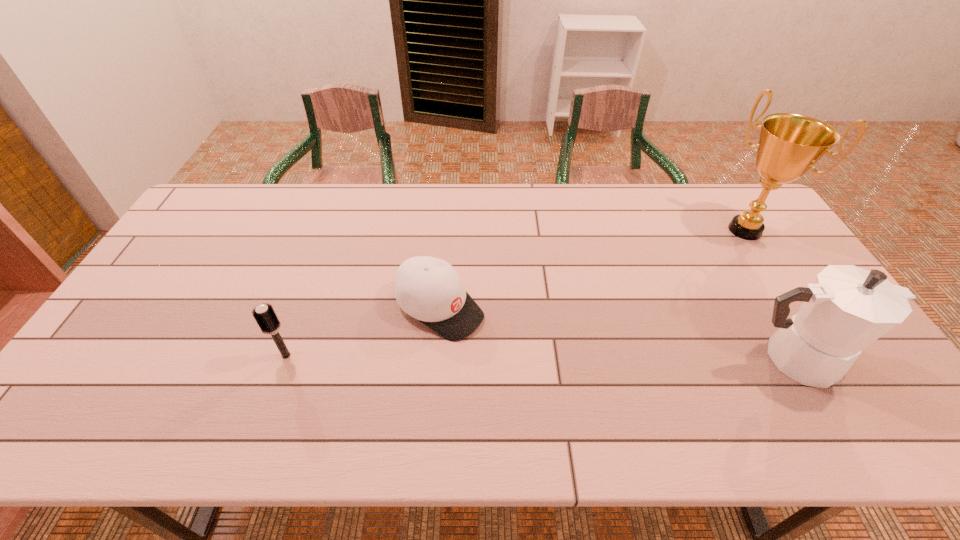
Identify the location of free space between the award and the coffeepot. This screenshot has width=960, height=540. (769, 294).

Locate an element on the screen. empty space between the third tallest object and the coffeepot is located at coordinates [x=540, y=357].

Select which object is the second closest to the award. Please provide its 2D coordinates. Your answer should be formatted as a tuple, i.e. [(x, y)], where the tuple contains the x and y coordinates of a point satisfying the conditions above.

[(429, 289)]

Locate which object ranks in proximity to the third shortest object. Please provide its 2D coordinates. Your answer should be formatted as a tuple, i.e. [(x, y)], where the tuple contains the x and y coordinates of a point satisfying the conditions above.

[(790, 144)]

Find the location of a particular element. This screenshot has width=960, height=540. vacant space that satisfies the following two spatial constraints: 1. on the back side of the award; 2. on the right side of the second shortest object is located at coordinates (331, 230).

Find the location of a particular element. This screenshot has height=540, width=960. vacant space that satisfies the following two spatial constraints: 1. on the front side of the second shortest object; 2. at the spout of the third shortest object is located at coordinates (285, 359).

The width and height of the screenshot is (960, 540). Find the location of `vacant space that satisfies the following two spatial constraints: 1. on the back side of the baseball cap; 2. on the left side of the farthest object`. vacant space that satisfies the following two spatial constraints: 1. on the back side of the baseball cap; 2. on the left side of the farthest object is located at coordinates (446, 230).

Locate an element on the screen. This screenshot has height=540, width=960. vacant space that satisfies the following two spatial constraints: 1. on the front side of the shortest object; 2. at the spout of the coffeepot is located at coordinates (436, 359).

Locate an element on the screen. vacant space that satisfies the following two spatial constraints: 1. on the front side of the coffeepot; 2. at the spout of the third tallest object is located at coordinates (285, 359).

Where is `free space that satisfies the following two spatial constraints: 1. on the front side of the coffeepot; 2. at the spout of the shortest object`? This screenshot has height=540, width=960. free space that satisfies the following two spatial constraints: 1. on the front side of the coffeepot; 2. at the spout of the shortest object is located at coordinates (436, 359).